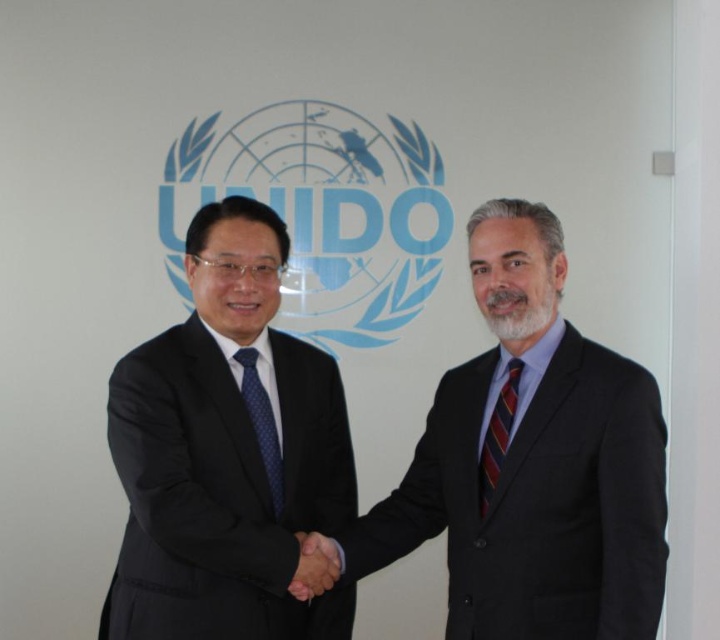
What do you see at coordinates (534, 464) in the screenshot? This screenshot has width=720, height=640. I see `dark suit at center` at bounding box center [534, 464].

Is dark suit at center shorter than smooth skin handshake at center?

Incorrect, dark suit at center's height does not fall short of smooth skin handshake at center's.

Where is `dark suit at center`? dark suit at center is located at coordinates (534, 464).

Where is `dark suit at center`? The image size is (720, 640). dark suit at center is located at coordinates (534, 464).

Identify the location of black suit at left. (228, 452).

Does black suit at left have a greater width compared to striped silk tie at right?

Yes, black suit at left is wider than striped silk tie at right.

This screenshot has width=720, height=640. Identify the location of black suit at left. (228, 452).

Image resolution: width=720 pixels, height=640 pixels. I want to click on black suit at left, so click(x=228, y=452).

Which of these two, dark suit at center or blue dotted tie at center, stands shorter?

With less height is blue dotted tie at center.

Which is behind, point (487, 618) or point (269, 451)?

Point (269, 451)

Find the location of `dark suit at center`. dark suit at center is located at coordinates (534, 464).